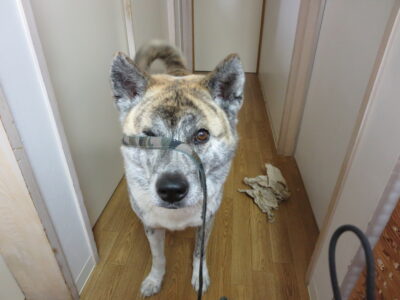
Locate an element on the screen. This screenshot has height=300, width=400. rug is located at coordinates point(398,277).